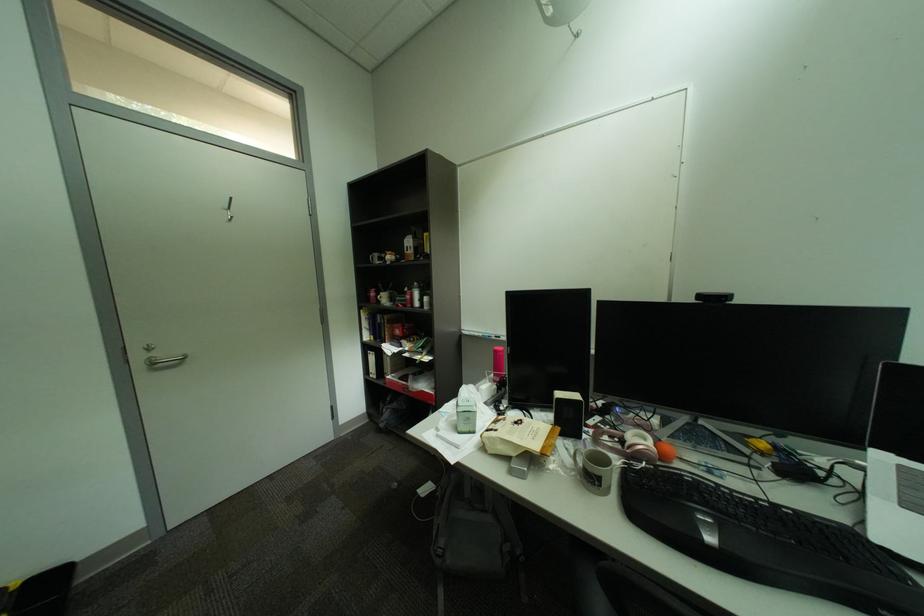
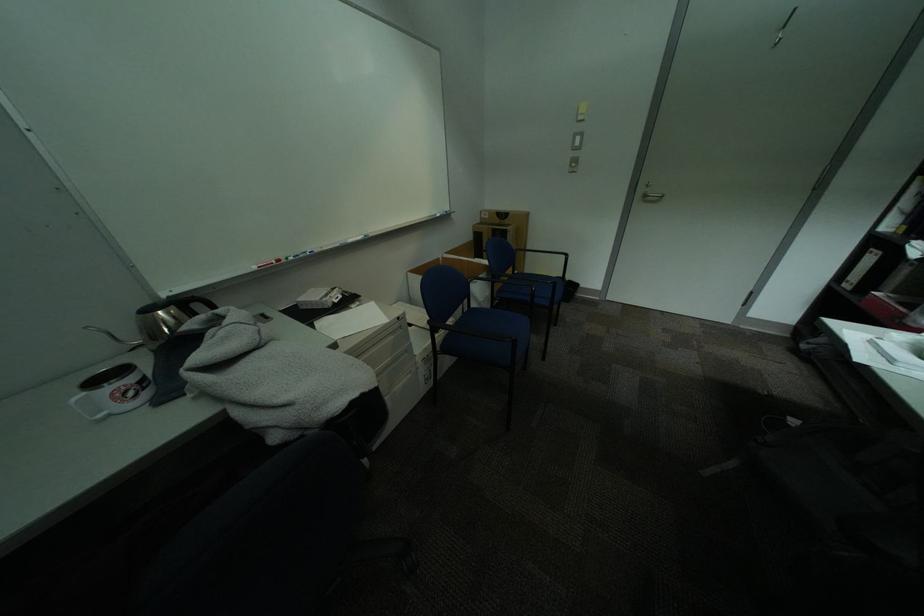
In the second image, find the point that corresponds to point 382,371 in the first image.

(859, 280)